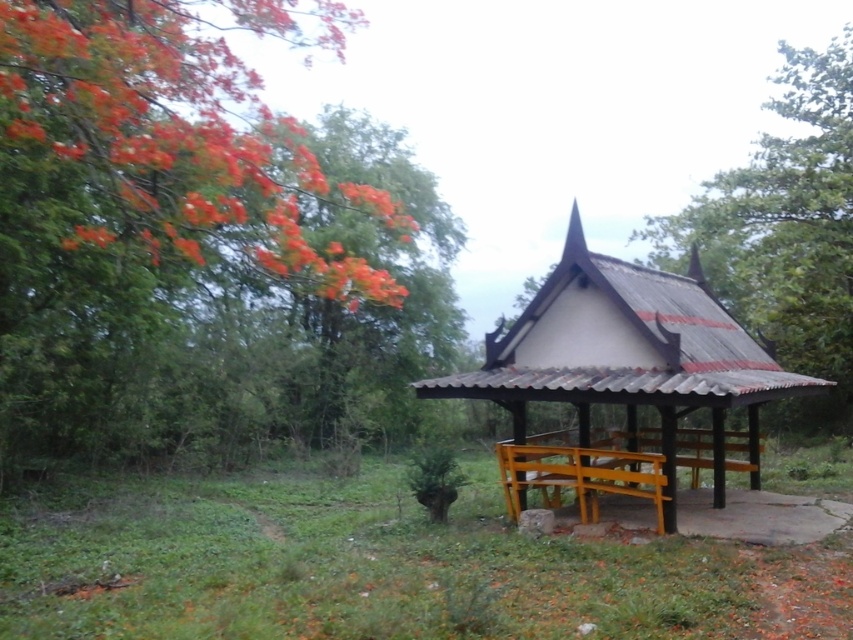
Question: Is orange blossoms at upper left above wooden bench at center?

Choices:
 (A) no
 (B) yes

Answer: (B)

Question: Among these points, which one is nearest to the camera?

Choices:
 (A) (827, 179)
 (B) (630, 422)
 (C) (93, 326)

Answer: (B)

Question: Which of these objects is positioned closest to the orange blossoms at upper left?

Choices:
 (A) green leafy tree at upper right
 (B) wooden bench at center

Answer: (B)

Question: Does wooden bench at center have a larger size compared to green leafy tree at upper right?

Choices:
 (A) no
 (B) yes

Answer: (A)

Question: Among these points, which one is nearest to the camera?

Choices:
 (A) (660, 266)
 (B) (387, 198)
 (C) (560, 337)

Answer: (C)

Question: Is orange blossoms at upper left positioned in front of wooden bench at center?

Choices:
 (A) yes
 (B) no

Answer: (A)